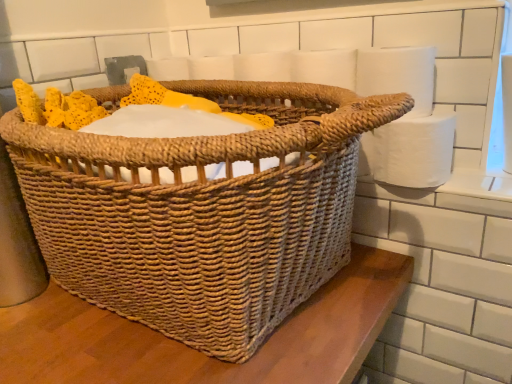
Question: Considering the relative positions of white paper at right, which ranks as the second toilet paper in top-to-bottom order, and woven natural picnic basket at center in the image provided, is white paper at right, which ranks as the second toilet paper in top-to-bottom order, to the right of woven natural picnic basket at center from the viewer's perspective?

Choices:
 (A) no
 (B) yes

Answer: (B)

Question: Is white paper at right, which ranks as the second toilet paper in top-to-bottom order, positioned behind woven natural picnic basket at center?

Choices:
 (A) no
 (B) yes

Answer: (B)

Question: From the image's perspective, is white paper at right, placed as the 1th toilet paper when sorted from bottom to top, on top of woven natural picnic basket at center?

Choices:
 (A) yes
 (B) no

Answer: (A)

Question: Does white paper at right, placed as the 1th toilet paper when sorted from bottom to top, have a larger size compared to woven natural picnic basket at center?

Choices:
 (A) no
 (B) yes

Answer: (A)

Question: From a real-world perspective, is white paper at right, which ranks as the second toilet paper in top-to-bottom order, positioned under woven natural picnic basket at center based on gravity?

Choices:
 (A) yes
 (B) no

Answer: (A)

Question: Do you think white matte toilet paper at upper right, placed as the 2th toilet paper when sorted from bottom to top, is within woven natural picnic basket at center, or outside of it?

Choices:
 (A) inside
 (B) outside

Answer: (B)

Question: Considering their positions, is white matte toilet paper at upper right, acting as the 1th toilet paper starting from the top, located in front of or behind woven natural picnic basket at center?

Choices:
 (A) front
 (B) behind

Answer: (B)

Question: From a real-world perspective, is white matte toilet paper at upper right, placed as the 2th toilet paper when sorted from bottom to top, positioned above or below woven natural picnic basket at center?

Choices:
 (A) below
 (B) above

Answer: (B)

Question: From the image's perspective, is white matte toilet paper at upper right, placed as the 2th toilet paper when sorted from bottom to top, positioned above or below woven natural picnic basket at center?

Choices:
 (A) below
 (B) above

Answer: (B)

Question: Visually, is woven natural picnic basket at center positioned to the left or to the right of white paper at right, which ranks as the second toilet paper in top-to-bottom order?

Choices:
 (A) left
 (B) right

Answer: (A)

Question: Is point (39, 170) closer or farther from the camera than point (448, 175)?

Choices:
 (A) closer
 (B) farther

Answer: (A)

Question: Looking at the image, does woven natural picnic basket at center seem bigger or smaller compared to white paper at right, placed as the 1th toilet paper when sorted from bottom to top?

Choices:
 (A) small
 (B) big

Answer: (B)

Question: Would you say woven natural picnic basket at center is inside or outside white paper at right, which ranks as the second toilet paper in top-to-bottom order?

Choices:
 (A) outside
 (B) inside

Answer: (A)

Question: Is woven natural picnic basket at center taller or shorter than white matte toilet paper at upper right, acting as the 1th toilet paper starting from the top?

Choices:
 (A) short
 (B) tall

Answer: (B)

Question: From a real-world perspective, is woven natural picnic basket at center above or below white matte toilet paper at upper right, placed as the 2th toilet paper when sorted from bottom to top?

Choices:
 (A) below
 (B) above

Answer: (A)